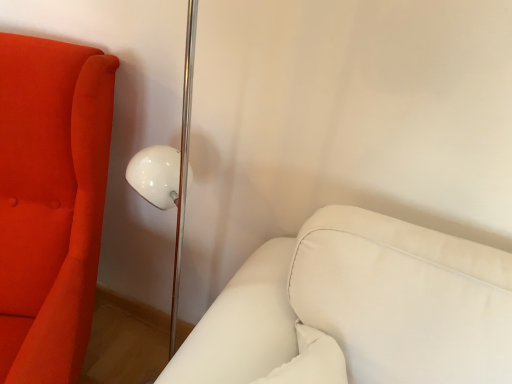
This screenshot has height=384, width=512. In order to click on matte orange sofa at left, the 2th furniture in the right-to-left sequence in this screenshot , I will do `click(50, 202)`.

Image resolution: width=512 pixels, height=384 pixels. Describe the element at coordinates (50, 202) in the screenshot. I see `matte orange sofa at left, placed as the 1th furniture when sorted from left to right` at that location.

The image size is (512, 384). Describe the element at coordinates (357, 309) in the screenshot. I see `white leather couch at lower right, positioned as the first furniture in right-to-left order` at that location.

The height and width of the screenshot is (384, 512). I want to click on white leather couch at lower right, positioned as the first furniture in right-to-left order, so click(x=357, y=309).

I want to click on matte orange sofa at left, the 2th furniture in the right-to-left sequence, so click(50, 202).

Between white leather couch at lower right, positioned as the first furniture in right-to-left order, and matte orange sofa at left, the 2th furniture in the right-to-left sequence, which one appears on the right side from the viewer's perspective?

white leather couch at lower right, positioned as the first furniture in right-to-left order.

Which object is closer to the camera, white leather couch at lower right, positioned as the first furniture in right-to-left order, or matte orange sofa at left, placed as the 1th furniture when sorted from left to right?

matte orange sofa at left, placed as the 1th furniture when sorted from left to right, is more forward.

Which is less distant, (454, 373) or (19, 382)?

Positioned in front is point (19, 382).

From the image's perspective, would you say white leather couch at lower right, positioned as the first furniture in right-to-left order, is positioned over matte orange sofa at left, placed as the 1th furniture when sorted from left to right?

No.

From a real-world perspective, is white leather couch at lower right, the second furniture from the left, located beneath matte orange sofa at left, the 2th furniture in the right-to-left sequence?

No, from a real-world perspective, white leather couch at lower right, the second furniture from the left, is not under matte orange sofa at left, the 2th furniture in the right-to-left sequence.

Can you confirm if white leather couch at lower right, the second furniture from the left, is thinner than matte orange sofa at left, placed as the 1th furniture when sorted from left to right?

Yes.

Considering the relative sizes of white leather couch at lower right, positioned as the first furniture in right-to-left order, and matte orange sofa at left, the 2th furniture in the right-to-left sequence, in the image provided, is white leather couch at lower right, positioned as the first furniture in right-to-left order, taller than matte orange sofa at left, the 2th furniture in the right-to-left sequence,?

No, white leather couch at lower right, positioned as the first furniture in right-to-left order, is not taller than matte orange sofa at left, the 2th furniture in the right-to-left sequence.

In terms of size, does white leather couch at lower right, positioned as the first furniture in right-to-left order, appear bigger or smaller than matte orange sofa at left, the 2th furniture in the right-to-left sequence?

white leather couch at lower right, positioned as the first furniture in right-to-left order, is smaller than matte orange sofa at left, the 2th furniture in the right-to-left sequence.

Is white leather couch at lower right, the second furniture from the left, inside the boundaries of matte orange sofa at left, the 2th furniture in the right-to-left sequence, or outside?

The correct answer is: outside.

Is white leather couch at lower right, positioned as the first furniture in right-to-left order, not near matte orange sofa at left, placed as the 1th furniture when sorted from left to right?

Actually, white leather couch at lower right, positioned as the first furniture in right-to-left order, and matte orange sofa at left, placed as the 1th furniture when sorted from left to right, are a little close together.

Is matte orange sofa at left, the 2th furniture in the right-to-left sequence, at the back of white leather couch at lower right, positioned as the first furniture in right-to-left order?

Yes.

Find the location of a particular element. The width and height of the screenshot is (512, 384). furniture located below the matte orange sofa at left, placed as the 1th furniture when sorted from left to right (from the image's perspective) is located at coordinates (357, 309).

Is matte orange sofa at left, the 2th furniture in the right-to-left sequence, to the right of white leather couch at lower right, the second furniture from the left, from the viewer's perspective?

Incorrect, matte orange sofa at left, the 2th furniture in the right-to-left sequence, is not on the right side of white leather couch at lower right, the second furniture from the left.

Is matte orange sofa at left, placed as the 1th furniture when sorted from left to right, closer to the viewer compared to white leather couch at lower right, the second furniture from the left?

Yes, matte orange sofa at left, placed as the 1th furniture when sorted from left to right, is closer to the camera.

Considering the positions of points (96, 49) and (296, 374), is point (96, 49) closer to camera compared to point (296, 374)?

That is False.

From the image's perspective, is matte orange sofa at left, the 2th furniture in the right-to-left sequence, above white leather couch at lower right, positioned as the first furniture in right-to-left order?

Indeed, from the image's perspective, matte orange sofa at left, the 2th furniture in the right-to-left sequence, is shown above white leather couch at lower right, positioned as the first furniture in right-to-left order.

From a real-world perspective, is matte orange sofa at left, placed as the 1th furniture when sorted from left to right, physically above white leather couch at lower right, positioned as the first furniture in right-to-left order?

Incorrect, from a real-world perspective, matte orange sofa at left, placed as the 1th furniture when sorted from left to right, is lower than white leather couch at lower right, positioned as the first furniture in right-to-left order.

Which object is thinner, matte orange sofa at left, the 2th furniture in the right-to-left sequence, or white leather couch at lower right, positioned as the first furniture in right-to-left order?

With smaller width is white leather couch at lower right, positioned as the first furniture in right-to-left order.

Does matte orange sofa at left, placed as the 1th furniture when sorted from left to right, have a lesser height compared to white leather couch at lower right, positioned as the first furniture in right-to-left order?

Incorrect, the height of matte orange sofa at left, placed as the 1th furniture when sorted from left to right, does not fall short of that of white leather couch at lower right, positioned as the first furniture in right-to-left order.

Which of these two, matte orange sofa at left, the 2th furniture in the right-to-left sequence, or white leather couch at lower right, the second furniture from the left, is bigger?

matte orange sofa at left, the 2th furniture in the right-to-left sequence, is bigger.

Choose the correct answer: Is matte orange sofa at left, the 2th furniture in the right-to-left sequence, inside white leather couch at lower right, the second furniture from the left, or outside it?

matte orange sofa at left, the 2th furniture in the right-to-left sequence, exists outside the volume of white leather couch at lower right, the second furniture from the left.

Is matte orange sofa at left, the 2th furniture in the right-to-left sequence, next to white leather couch at lower right, the second furniture from the left, and touching it?

No, matte orange sofa at left, the 2th furniture in the right-to-left sequence, is not in contact with white leather couch at lower right, the second furniture from the left.

Could you tell me if matte orange sofa at left, placed as the 1th furniture when sorted from left to right, is turned towards white leather couch at lower right, positioned as the first furniture in right-to-left order?

No, matte orange sofa at left, placed as the 1th furniture when sorted from left to right, does not turn towards white leather couch at lower right, positioned as the first furniture in right-to-left order.

How distant is matte orange sofa at left, placed as the 1th furniture when sorted from left to right, from white leather couch at lower right, the second furniture from the left?

matte orange sofa at left, placed as the 1th furniture when sorted from left to right, and white leather couch at lower right, the second furniture from the left, are 19.97 inches apart.

Locate an element on the screen. This screenshot has width=512, height=384. furniture that appears below the matte orange sofa at left, placed as the 1th furniture when sorted from left to right (from the image's perspective) is located at coordinates coord(357,309).

Where is `furniture in front of the white leather couch at lower right, the second furniture from the left`? furniture in front of the white leather couch at lower right, the second furniture from the left is located at coordinates (50, 202).

The image size is (512, 384). In order to click on furniture on the left side of white leather couch at lower right, the second furniture from the left in this screenshot , I will do `click(50, 202)`.